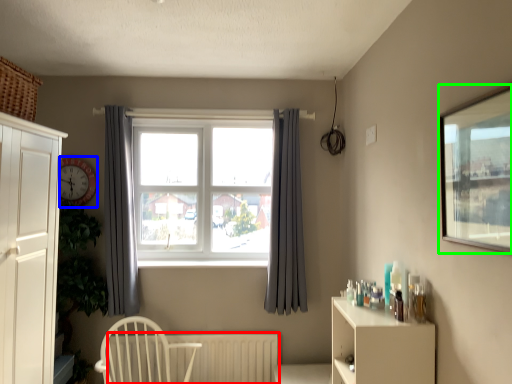
Question: Based on their relative distances, which object is nearer to radiator (highlighted by a red box)? Choose from clock (highlighted by a blue box) and window screen (highlighted by a green box).

Choices:
 (A) clock
 (B) window screen

Answer: (A)